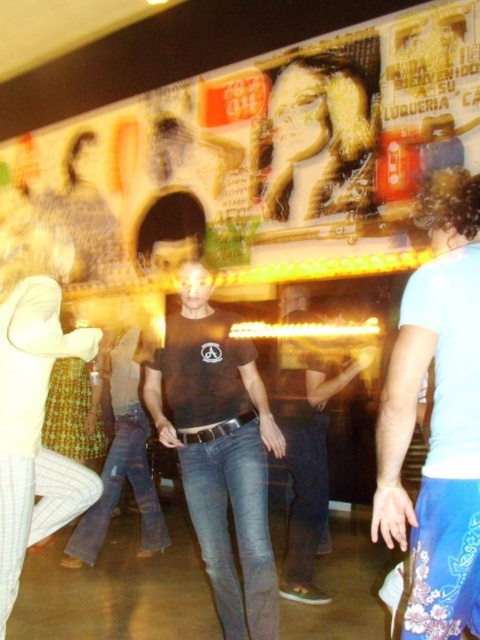
You are at a party and want to find the person with the matte gold hair at upper center. You see the light blue denim jeans at center. Which object is smaller?

The light blue denim jeans at center is smaller than the matte gold hair at upper center.

You are at a social gathering and want to take a photo of two specific points in the scene. The first point is labeled as point (26, 296) and the second is point (291, 381). Which point is closer to you?

Point (26, 296) is closer to the viewer than point (291, 381).